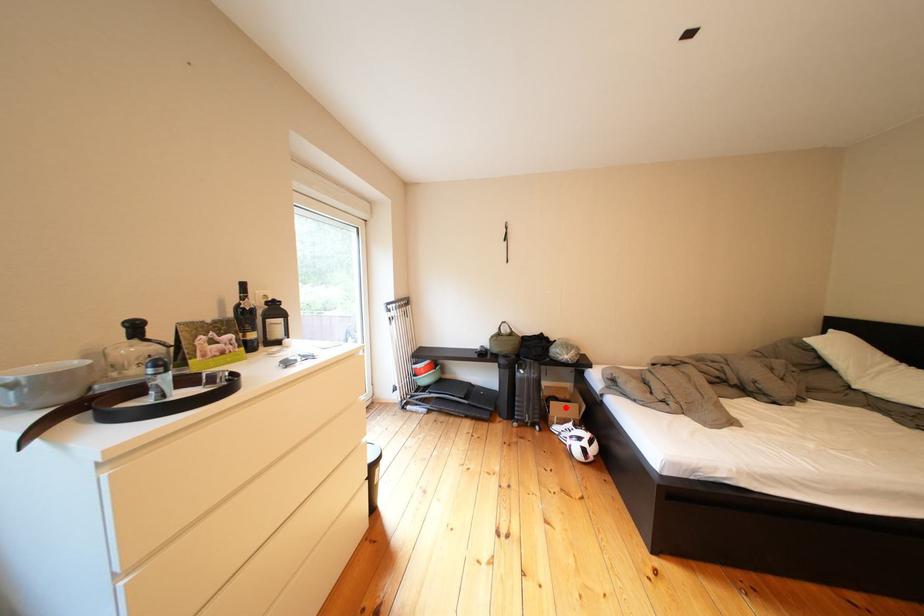
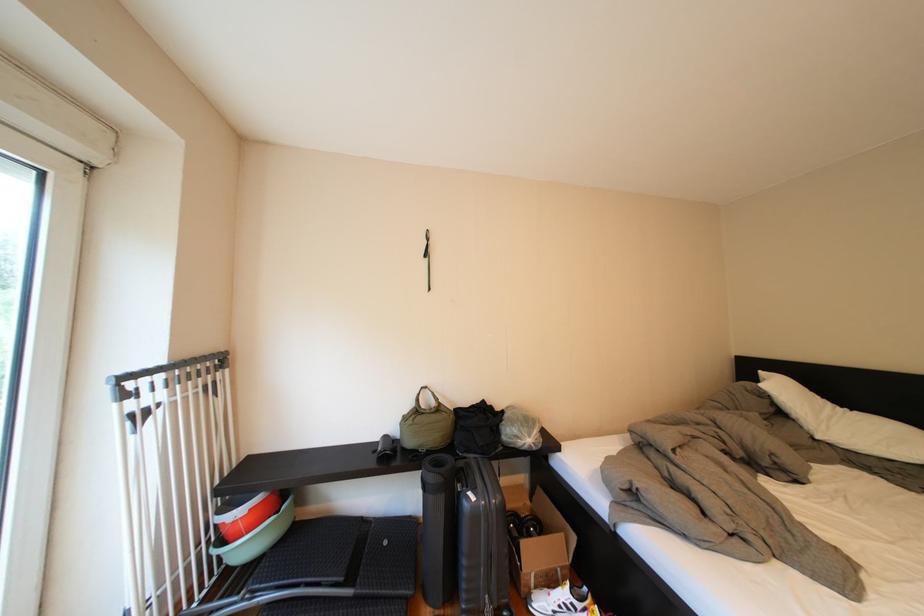
Question: I am providing you with two images of the same scene from different viewpoints. Image1 has a red point marked. In image2, the corresponding 3D location appears at what relative position? Reply with the corresponding letter.

Choices:
 (A) Closer
 (B) Farther

Answer: (A)